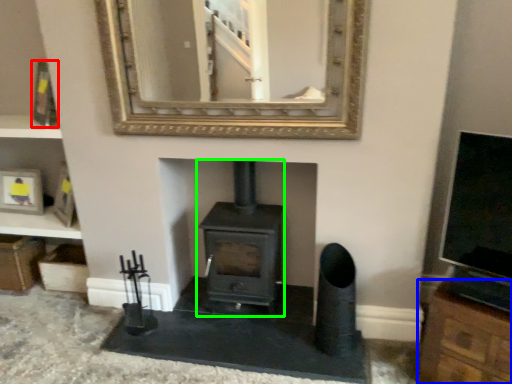
Question: Which is farther away from picture frame (highlighted by a red box)? cabinetry (highlighted by a blue box) or wood burning stove (highlighted by a green box)?

Choices:
 (A) cabinetry
 (B) wood burning stove

Answer: (A)